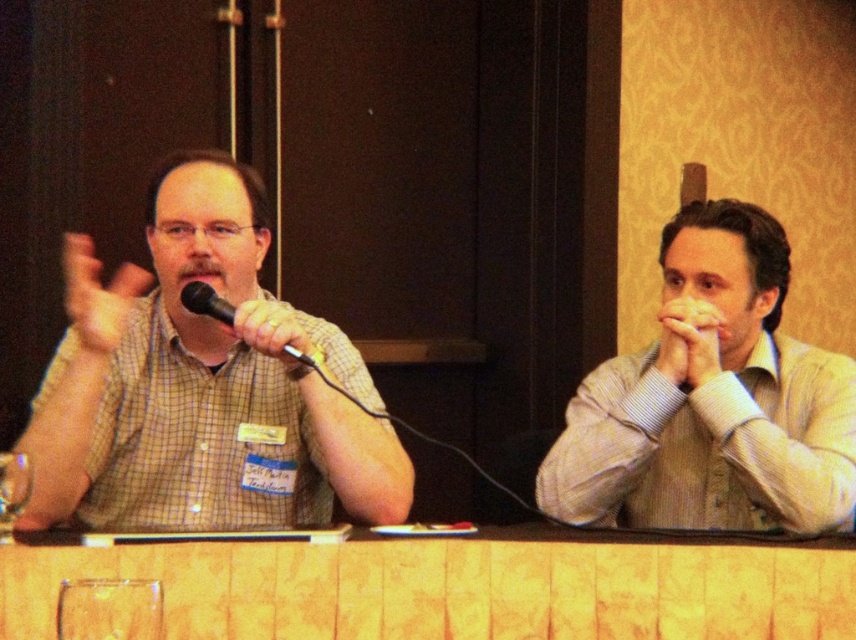
Is checkered fabric shirt at left above transparent glass at lower left?

Yes, checkered fabric shirt at left is above transparent glass at lower left.

Who is more forward, (310, 458) or (0, 516)?

Point (0, 516)

You are a GUI agent. You are given a task and a screenshot of the screen. Output one action in this format:
    pyautogui.click(x=<x>, y=<y>)
    Task: Click on the checkered fabric shirt at left
    The width and height of the screenshot is (856, 640).
    Given the screenshot: What is the action you would take?
    pyautogui.click(x=200, y=387)

Image resolution: width=856 pixels, height=640 pixels. Find the location of `checkered fabric shirt at left`. checkered fabric shirt at left is located at coordinates pyautogui.click(x=200, y=387).

From the picture: Does wooden table at center have a lesser width compared to smooth skin hands at center?

No, wooden table at center is not thinner than smooth skin hands at center.

Which is in front, point (597, 621) or point (694, 378)?

Point (597, 621) is in front.

Which is in front, point (334, 579) or point (676, 326)?

Positioned in front is point (334, 579).

The image size is (856, 640). Identify the location of wooden table at center. (456, 588).

Which is in front, point (86, 264) or point (260, 337)?

Point (260, 337) is more forward.

Can you confirm if matte yellow hand at upper left is wider than matte black microphone at center?

Yes, matte yellow hand at upper left is wider than matte black microphone at center.

Which is in front, point (128, 300) or point (276, 342)?

Point (276, 342) is in front.

This screenshot has height=640, width=856. I want to click on matte yellow hand at upper left, so click(x=97, y=298).